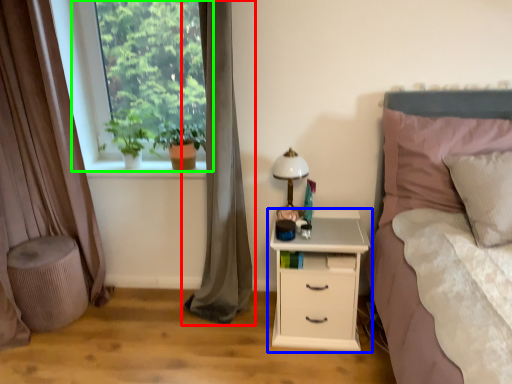
Question: Which object is positioned closest to curtain (highlighted by a red box)? Select from nightstand (highlighted by a blue box) and window (highlighted by a green box).

Choices:
 (A) nightstand
 (B) window

Answer: (A)